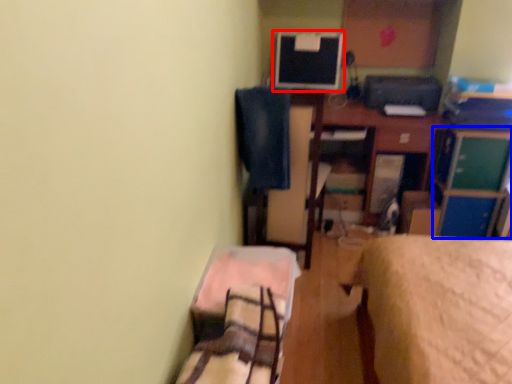
Question: Which of the following is the closest to the observer, computer monitor (highlighted by a red box) or file cabinet (highlighted by a blue box)?

Choices:
 (A) computer monitor
 (B) file cabinet

Answer: (B)